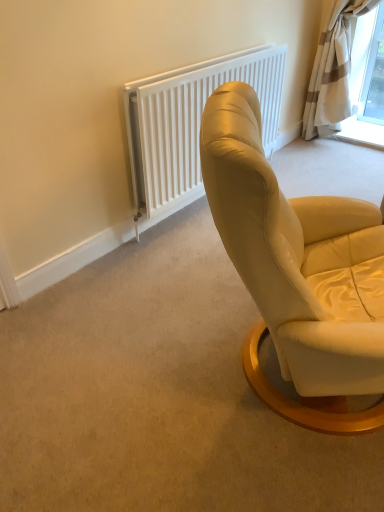
Question: From the image's perspective, is white textured radiator at upper center above or below beige striped fabric curtain at upper right?

Choices:
 (A) above
 (B) below

Answer: (B)

Question: In terms of width, does white textured radiator at upper center look wider or thinner when compared to beige striped fabric curtain at upper right?

Choices:
 (A) thin
 (B) wide

Answer: (A)

Question: Is white textured radiator at upper center taller or shorter than beige striped fabric curtain at upper right?

Choices:
 (A) short
 (B) tall

Answer: (A)

Question: Is beige striped fabric curtain at upper right in front of or behind white textured radiator at upper center in the image?

Choices:
 (A) front
 (B) behind

Answer: (B)

Question: Based on their sizes in the image, would you say beige striped fabric curtain at upper right is bigger or smaller than white textured radiator at upper center?

Choices:
 (A) small
 (B) big

Answer: (B)

Question: Choose the correct answer: Is beige striped fabric curtain at upper right inside white textured radiator at upper center or outside it?

Choices:
 (A) inside
 (B) outside

Answer: (B)

Question: From the image's perspective, relative to white textured radiator at upper center, is beige striped fabric curtain at upper right above or below?

Choices:
 (A) above
 (B) below

Answer: (A)